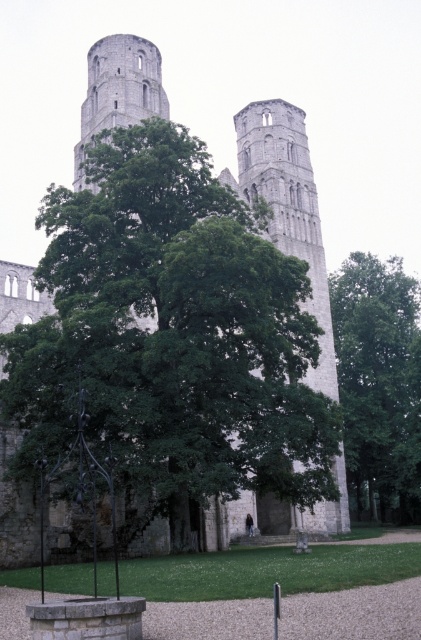
Question: Is green leafy tree at right below gray stone tower at center?

Choices:
 (A) no
 (B) yes

Answer: (B)

Question: Among these points, which one is nearest to the camera?

Choices:
 (A) pyautogui.click(x=346, y=522)
 (B) pyautogui.click(x=362, y=285)

Answer: (A)

Question: Which point is farther from the camera taking this photo?

Choices:
 (A) (21, 360)
 (B) (343, 528)

Answer: (B)

Question: Which object appears closest to the camera in this image?

Choices:
 (A) gray stone tower at center
 (B) green leafy tree at center
 (C) green leafy tree at right

Answer: (B)

Question: Can you confirm if green leafy tree at center is smaller than gray stone tower at center?

Choices:
 (A) yes
 (B) no

Answer: (A)

Question: Can you confirm if green leafy tree at center is positioned to the left of green leafy tree at right?

Choices:
 (A) yes
 (B) no

Answer: (A)